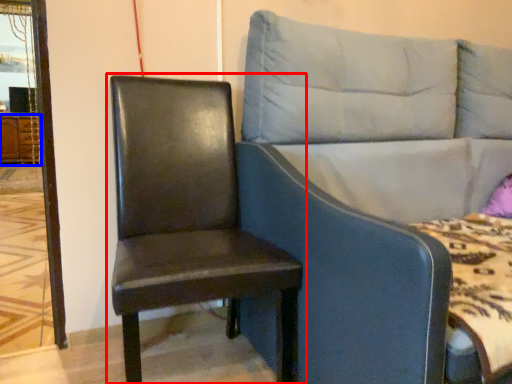
Question: Among these objects, which one is farthest to the camera, chair (highlighted by a red box) or dresser (highlighted by a blue box)?

Choices:
 (A) chair
 (B) dresser

Answer: (B)